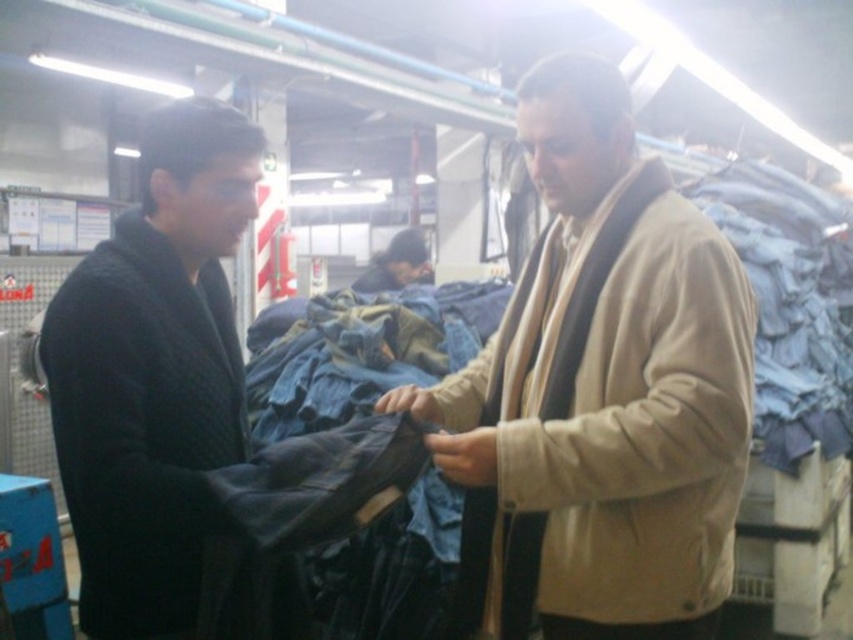
You are a delivery person standing at the entrance of the warehouse. You need to hand over a package to the person holding the beige fabric jacket at center. The delivery robot you are using has a maximum reach of 4 feet. Can the robot deliver the package directly to the person without you moving closer?

The beige fabric jacket at center and viewer are 4.01 feet apart from each other. Since the robot has a maximum reach of 4 feet, the distance is slightly more than the robot can handle. Therefore, you would need to move closer to ensure the package can be delivered.

You are a delivery person who needs to hand over a package to the person closer to you. The package is for the person wearing the beige fabric jacket at center and the black woolen sweater at left. Which individual should you approach first?

The beige fabric jacket at center is closer to you than the black woolen sweater at left, so you should approach the person wearing the beige fabric jacket at center first.

Based on the photo, you are a delivery person who needs to place a package between the beige fabric jacket at center and the dark blue denim jacket at center. The package requires a space of 3 meters. Is there enough space between them?

The distance between the beige fabric jacket at center and the dark blue denim jacket at center is 3.13 meters, so yes, the package can be placed between them as there is sufficient space.